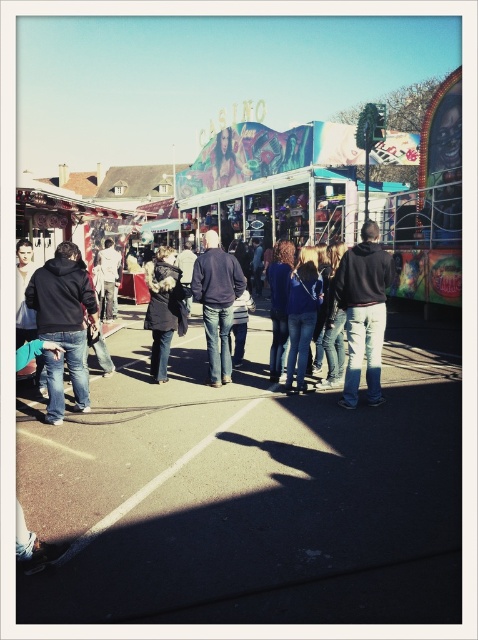
You are standing at the fairground and see the black asphalt at center and the denim jacket at center. Which object is positioned to the right of the other?

The black asphalt at center is to the right of the denim jacket at center.